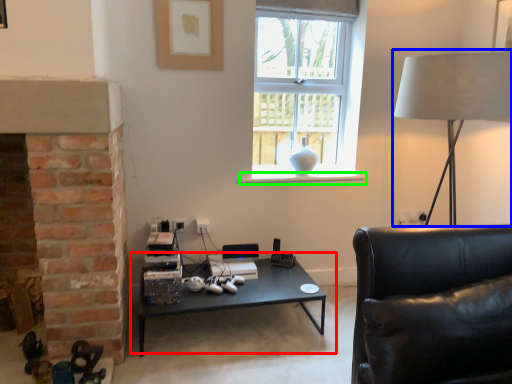
Question: Which is nearer to the coffee table (highlighted by a red box)? table lamp (highlighted by a blue box) or window sill (highlighted by a green box).

Choices:
 (A) table lamp
 (B) window sill

Answer: (B)